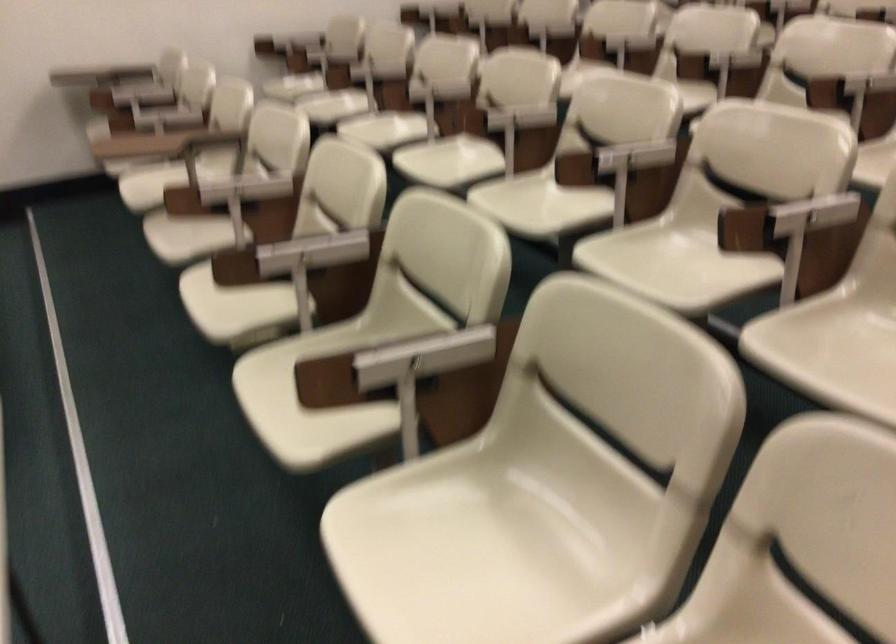
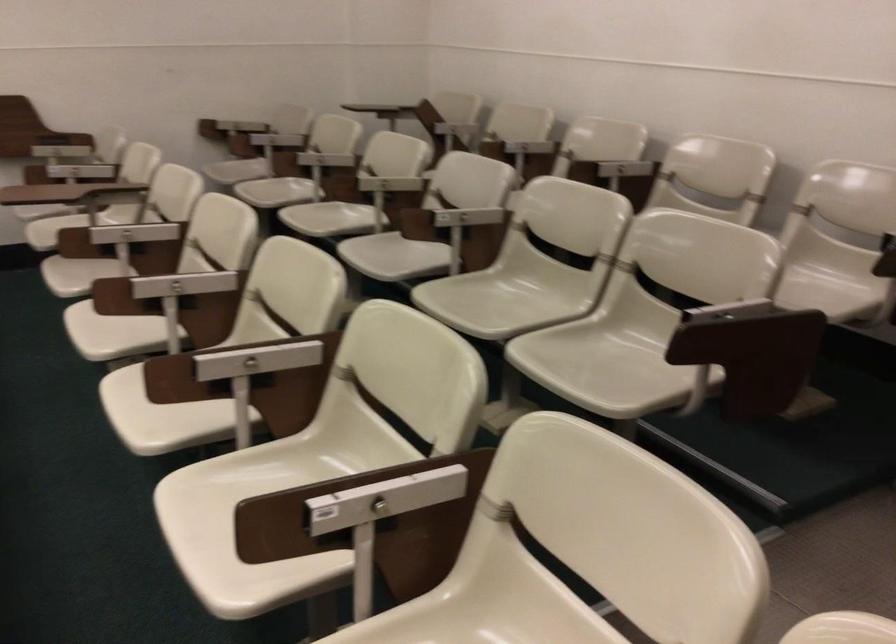
Question: How did the camera likely rotate?

Choices:
 (A) Left
 (B) Right
 (C) Up
 (D) Down

Answer: (C)